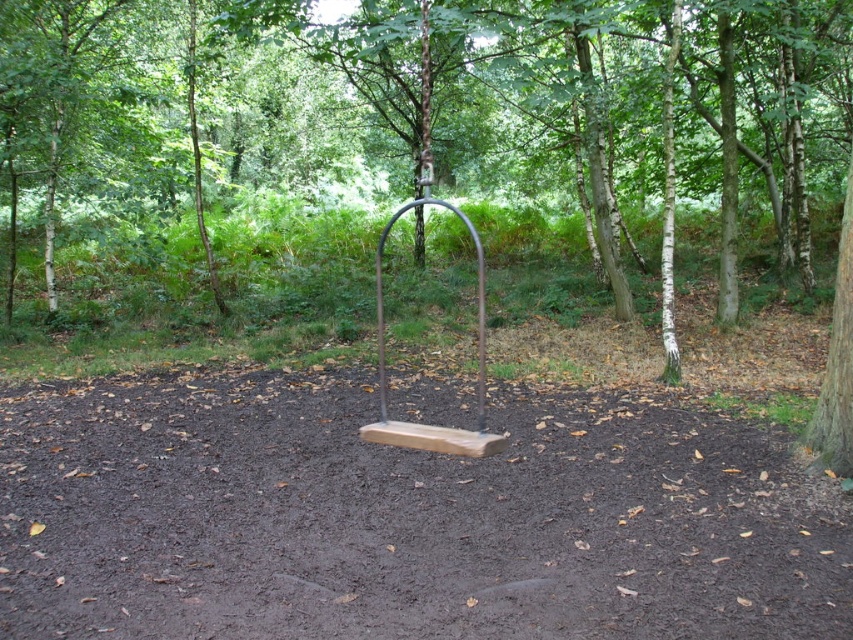
Question: Is brown wood tree at center to the right of brown wooden swing at center from the viewer's perspective?

Choices:
 (A) no
 (B) yes

Answer: (B)

Question: Which object appears farthest from the camera in this image?

Choices:
 (A) brown wooden swing at center
 (B) brown wood tree at center

Answer: (B)

Question: Among these points, which one is nearest to the camera?

Choices:
 (A) pyautogui.click(x=793, y=8)
 (B) pyautogui.click(x=421, y=449)

Answer: (B)

Question: Can you confirm if brown wood tree at center is smaller than brown wooden swing at center?

Choices:
 (A) yes
 (B) no

Answer: (B)

Question: Is the position of brown wood tree at center less distant than that of brown wooden swing at center?

Choices:
 (A) no
 (B) yes

Answer: (A)